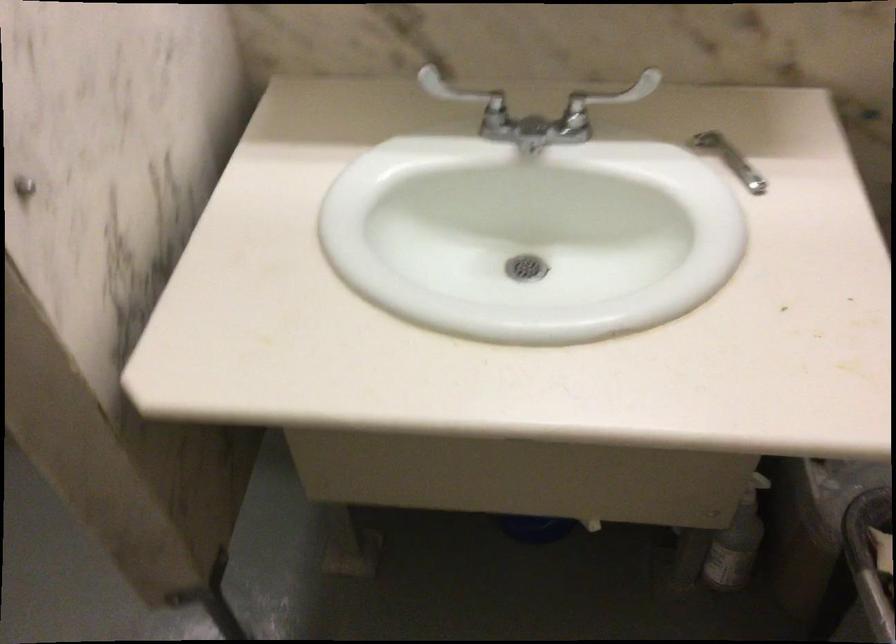
Where is `bottle pump dispenser`? bottle pump dispenser is located at coordinates (737, 542).